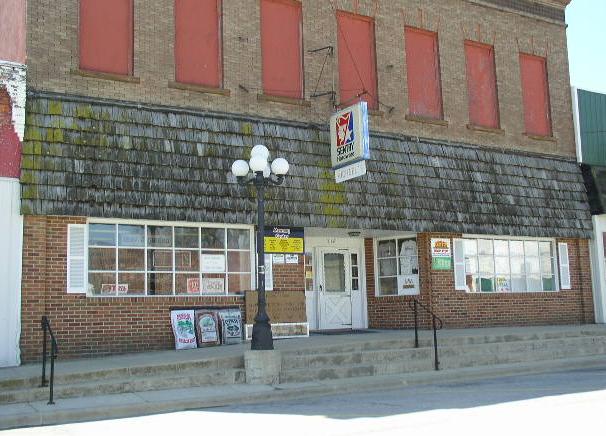
What are the coordinates of `doormat` in the screenshot? It's located at (345, 330).